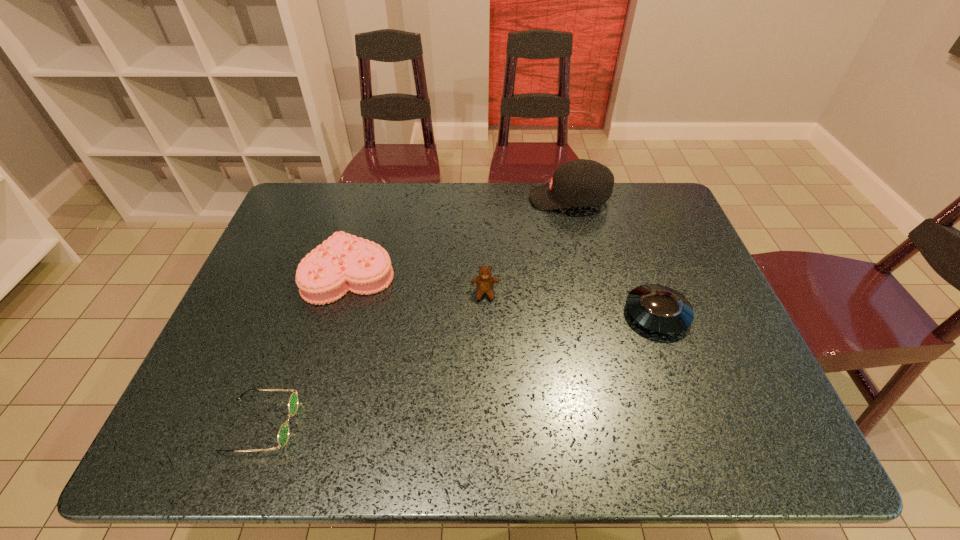
This screenshot has width=960, height=540. I want to click on object that is at the near left corner, so click(283, 433).

The height and width of the screenshot is (540, 960). What are the coordinates of `vacant area at the far edge of the desktop` in the screenshot? It's located at (513, 225).

The height and width of the screenshot is (540, 960). Find the location of `free region at the near edge of the desktop`. free region at the near edge of the desktop is located at coordinates (460, 424).

The image size is (960, 540). Find the location of `vacant space at the left edge of the desktop`. vacant space at the left edge of the desktop is located at coordinates (285, 269).

Locate an element on the screen. free region at the right edge of the desktop is located at coordinates [698, 289].

In the image, there is a desktop. Where is `free region at the far left corner`? free region at the far left corner is located at coordinates (298, 216).

Identify the location of vacant space at the far right corner of the desktop. (617, 182).

This screenshot has height=540, width=960. In order to click on free space between the spectacles and the baseball cap in this screenshot , I will do `click(415, 312)`.

Identify the location of vacant space that is in between the cake and the baseball cap. The height and width of the screenshot is (540, 960). (460, 236).

The height and width of the screenshot is (540, 960). I want to click on unoccupied area between the cake and the shortest object, so click(305, 349).